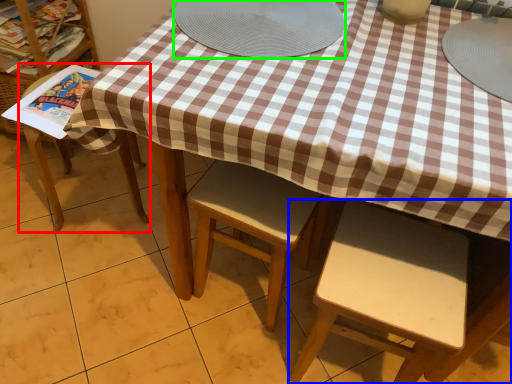
Question: Based on their relative distances, which object is nearer to chair (highlighted by a red box)? Choose from chair (highlighted by a blue box) and platter (highlighted by a green box).

Choices:
 (A) chair
 (B) platter

Answer: (B)